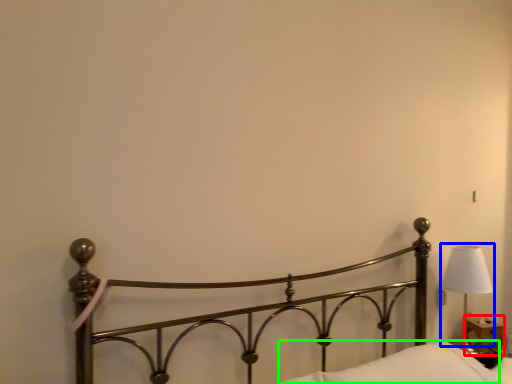
Question: Which object is positioned closest to table (highlighted by a red box)? Select from lamp (highlighted by a blue box) and pillow (highlighted by a green box).

Choices:
 (A) lamp
 (B) pillow

Answer: (A)